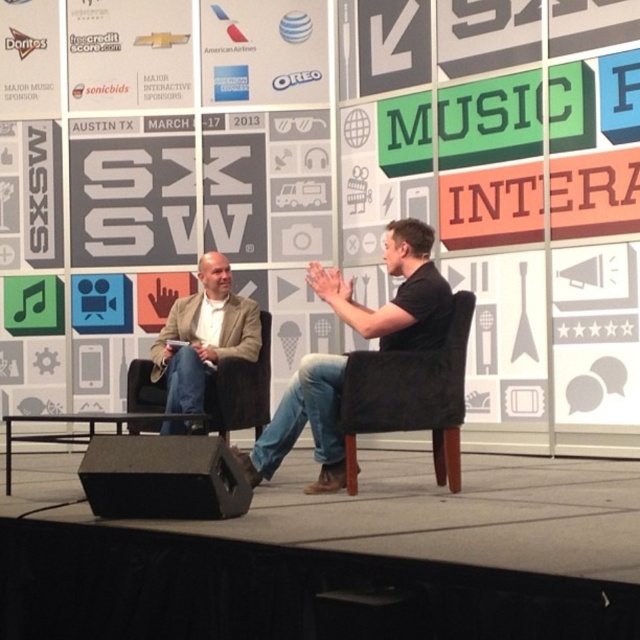
Who is lower down, black fabric armchair at center or light brown leather jacket at left?

black fabric armchair at center is lower down.

Between black fabric armchair at center and light brown leather jacket at left, which one has more height?

light brown leather jacket at left

Where is `black fabric armchair at center`? This screenshot has width=640, height=640. black fabric armchair at center is located at coordinates (410, 394).

Which is more to the left, black leather chair at center or black matte speaker at lower left?

Positioned to the left is black matte speaker at lower left.

Is point (340, 282) positioned in front of point (81, 480)?

No, it is behind (81, 480).

Who is more forward, [396,317] or [172,516]?

Point [172,516] is more forward.

Find the location of a particular element. The image size is (640, 640). black leather chair at center is located at coordinates (396, 292).

Between black matte speaker at lower left and light brown leather jacket at left, which one appears on the right side from the viewer's perspective?

Positioned to the right is black matte speaker at lower left.

Between point (224, 515) and point (205, 285), which one is positioned in front?

Point (224, 515)

Identify the location of black matte speaker at lower left. Image resolution: width=640 pixels, height=640 pixels. (163, 477).